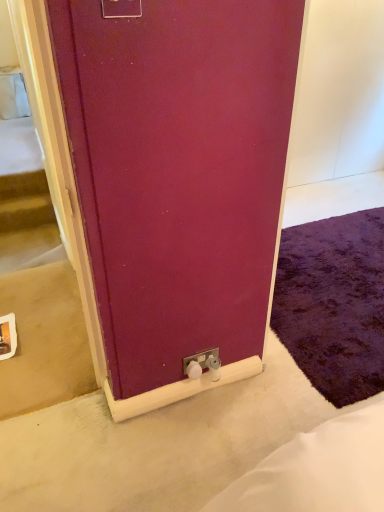
Question: Is the position of purple shaggy rug at lower right less distant than that of matte plastic electric outlet at upper center, the second electric outlet in the bottom-to-top sequence?

Choices:
 (A) no
 (B) yes

Answer: (A)

Question: From the image's perspective, is purple shaggy rug at lower right over matte plastic electric outlet at upper center, the first electric outlet viewed from the front?

Choices:
 (A) yes
 (B) no

Answer: (B)

Question: Is purple shaggy rug at lower right to the left of matte plastic electric outlet at upper center, the second electric outlet in the bottom-to-top sequence, from the viewer's perspective?

Choices:
 (A) yes
 (B) no

Answer: (B)

Question: Is purple shaggy rug at lower right next to matte plastic electric outlet at upper center, acting as the 2th electric outlet starting from the right?

Choices:
 (A) yes
 (B) no

Answer: (B)

Question: Is purple shaggy rug at lower right wider than matte plastic electric outlet at upper center, the second electric outlet in the bottom-to-top sequence?

Choices:
 (A) no
 (B) yes

Answer: (B)

Question: Looking at the image, does white plastic electric outlet at lower center, which is the 2th electric outlet in left-to-right order, seem bigger or smaller compared to purple shaggy rug at lower right?

Choices:
 (A) big
 (B) small

Answer: (B)

Question: Considering the positions of white plastic electric outlet at lower center, the first electric outlet in the right-to-left sequence, and purple shaggy rug at lower right in the image, is white plastic electric outlet at lower center, the first electric outlet in the right-to-left sequence, wider or thinner than purple shaggy rug at lower right?

Choices:
 (A) thin
 (B) wide

Answer: (A)

Question: Relative to purple shaggy rug at lower right, is white plastic electric outlet at lower center, the 1th electric outlet positioned from the bottom, in front or behind?

Choices:
 (A) behind
 (B) front

Answer: (B)

Question: From the image's perspective, is white plastic electric outlet at lower center, acting as the second electric outlet starting from the top, above or below purple shaggy rug at lower right?

Choices:
 (A) below
 (B) above

Answer: (A)

Question: Is purple shaggy rug at lower right wider or thinner than white plastic electric outlet at lower center, the first electric outlet in the right-to-left sequence?

Choices:
 (A) wide
 (B) thin

Answer: (A)

Question: Based on their sizes in the image, would you say purple shaggy rug at lower right is bigger or smaller than white plastic electric outlet at lower center, placed as the 1th electric outlet when sorted from back to front?

Choices:
 (A) small
 (B) big

Answer: (B)

Question: Is purple shaggy rug at lower right situated inside white plastic electric outlet at lower center, which ranks as the 2th electric outlet in front-to-back order, or outside?

Choices:
 (A) inside
 (B) outside

Answer: (B)

Question: Is point (354, 335) positioned closer to the camera than point (200, 362)?

Choices:
 (A) closer
 (B) farther

Answer: (B)

Question: Considering the positions of point (119, 0) and point (345, 290), is point (119, 0) closer or farther from the camera than point (345, 290)?

Choices:
 (A) farther
 (B) closer

Answer: (B)

Question: Is matte plastic electric outlet at upper center, positioned as the second electric outlet in back-to-front order, wider or thinner than purple shaggy rug at lower right?

Choices:
 (A) wide
 (B) thin

Answer: (B)